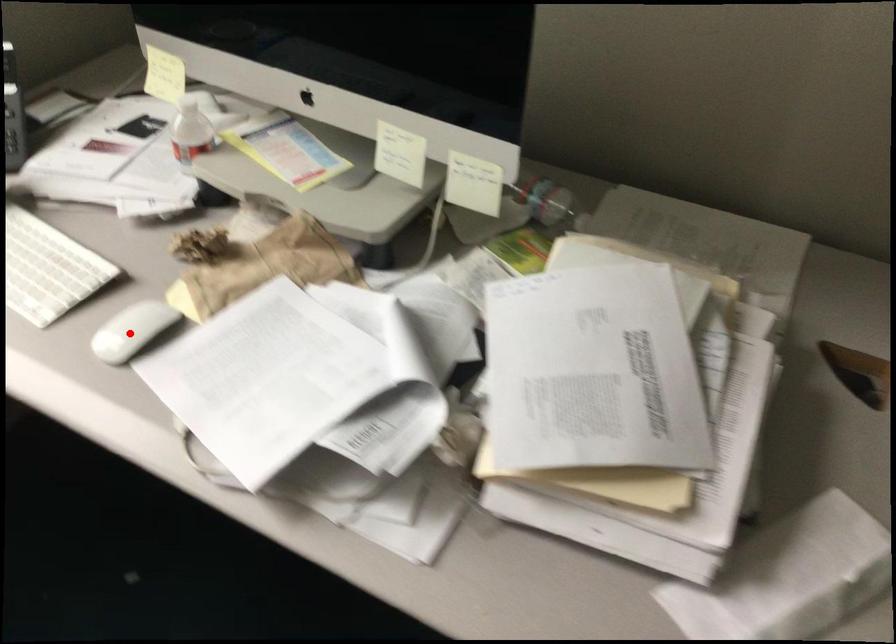
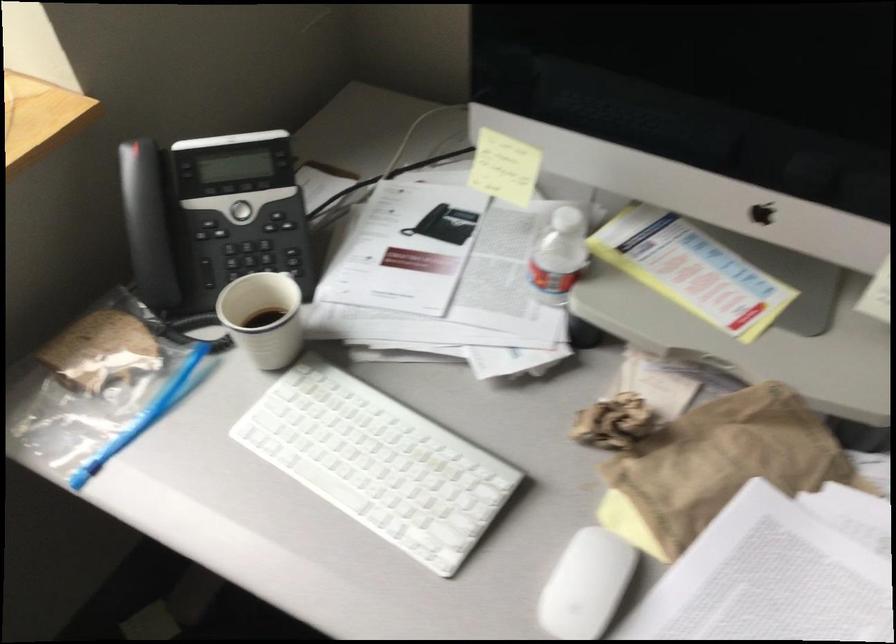
Where in the second image is the point corresponding to the highlighted location from the first image?

(586, 585)